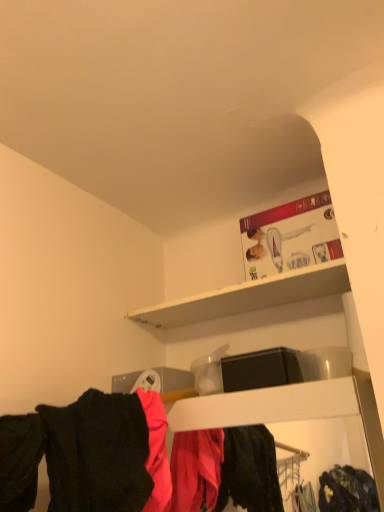
Question: From the image's perspective, is matte black clothing at lower center on black matte shirt at lower left?

Choices:
 (A) yes
 (B) no

Answer: (B)

Question: Can you see matte black clothing at lower center touching black matte shirt at lower left?

Choices:
 (A) yes
 (B) no

Answer: (A)

Question: Considering the relative sizes of matte black clothing at lower center and black matte shirt at lower left in the image provided, is matte black clothing at lower center taller than black matte shirt at lower left?

Choices:
 (A) no
 (B) yes

Answer: (B)

Question: Is matte black clothing at lower center positioned beyond the bounds of black matte shirt at lower left?

Choices:
 (A) yes
 (B) no

Answer: (A)

Question: From a real-world perspective, is matte black clothing at lower center under black matte shirt at lower left?

Choices:
 (A) yes
 (B) no

Answer: (A)

Question: Considering the relative sizes of matte black clothing at lower center and black matte shirt at lower left in the image provided, is matte black clothing at lower center smaller than black matte shirt at lower left?

Choices:
 (A) yes
 (B) no

Answer: (B)

Question: Does white matte shelf at upper center have a lesser width compared to black matte shirt at lower left?

Choices:
 (A) no
 (B) yes

Answer: (B)

Question: Is white matte shelf at upper center next to black matte shirt at lower left?

Choices:
 (A) yes
 (B) no

Answer: (B)

Question: Is black matte shirt at lower left at the back of white matte shelf at upper center?

Choices:
 (A) no
 (B) yes

Answer: (A)

Question: Could you tell me if white matte shelf at upper center is facing black matte shirt at lower left?

Choices:
 (A) yes
 (B) no

Answer: (B)

Question: Considering the relative sizes of white matte shelf at upper center and black matte shirt at lower left in the image provided, is white matte shelf at upper center wider than black matte shirt at lower left?

Choices:
 (A) no
 (B) yes

Answer: (A)

Question: Is white matte shelf at upper center shorter than black matte shirt at lower left?

Choices:
 (A) yes
 (B) no

Answer: (A)

Question: From a real-world perspective, is matte black clothing at lower center positioned over white matte shelf at upper center based on gravity?

Choices:
 (A) yes
 (B) no

Answer: (B)